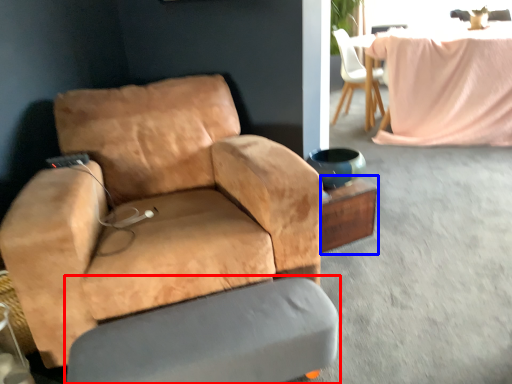
Question: Which point is closer to the camera, swivel chair (highlighted by a red box) or side table (highlighted by a blue box)?

Choices:
 (A) swivel chair
 (B) side table

Answer: (A)